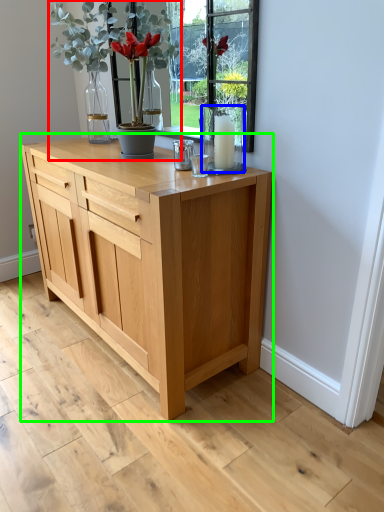
Question: Estimate the real-world distances between objects in this image. Which object is closer to houseplant (highlighted by a red box), glass vase (highlighted by a blue box) or chest of drawers (highlighted by a green box)?

Choices:
 (A) glass vase
 (B) chest of drawers

Answer: (A)